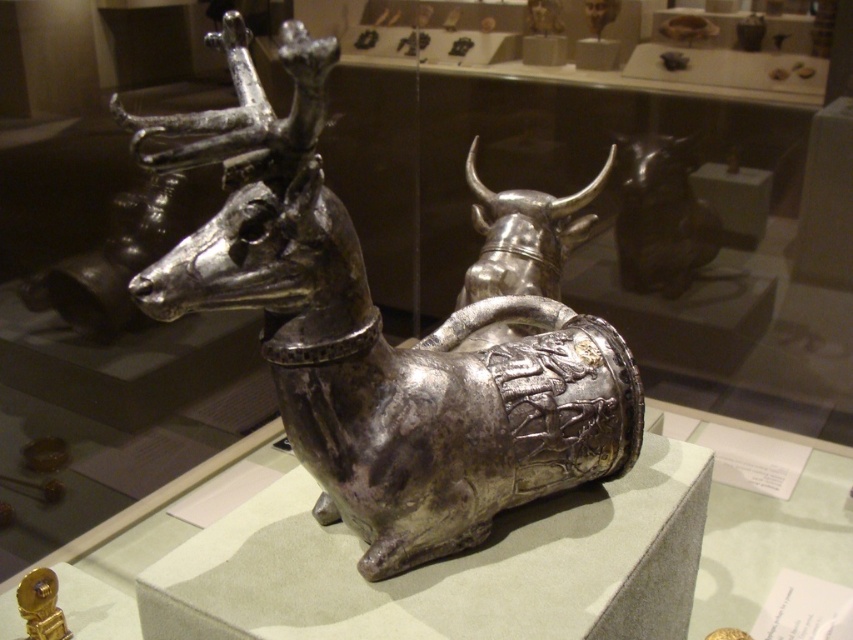
You are a photographer standing at a certain position in the museum. You want to take a clear photo of the polished silver bull at center without any blur. The camera you are using has a minimum focus distance of 5 feet. Can you take the photo from your current position?

The polished silver bull at center and camera are 4.95 feet apart from each other. Since the minimum focus distance of the camera is 5 feet, the camera cannot focus properly at 4.95 feet. Therefore, you need to move back to ensure the distance is at least 5 feet to avoid blur.

You are a museum curator planning to rearrange the exhibits. You want to place a new golden vase between the polished silver bull at center and the shiny black statue at upper right. Based on their current positions, where should you place the vase to maintain the existing spatial relationship?

The polished silver bull at center is positioned on the left side of shiny black statue at upper right. To maintain the spatial relationship, place the golden vase between them so that it sits to the right of the polished silver bull at center and to the left of the shiny black statue at upper right.

You are an art curator planning to move the polished silver bull at center and the shiny black statue at upper right to a new exhibition space. The new space has a height restriction of 1.5 meters. Can both objects be displayed without any modifications?

The polished silver bull at center is much taller than the shiny black statue at upper right. Since the height restriction is 1.5 meters, we need to know the exact height of the taller object. However, the description only states the relative size between them. Without specific measurements, it is impossible to confirm if both can fit under the 1.5 meter limit.